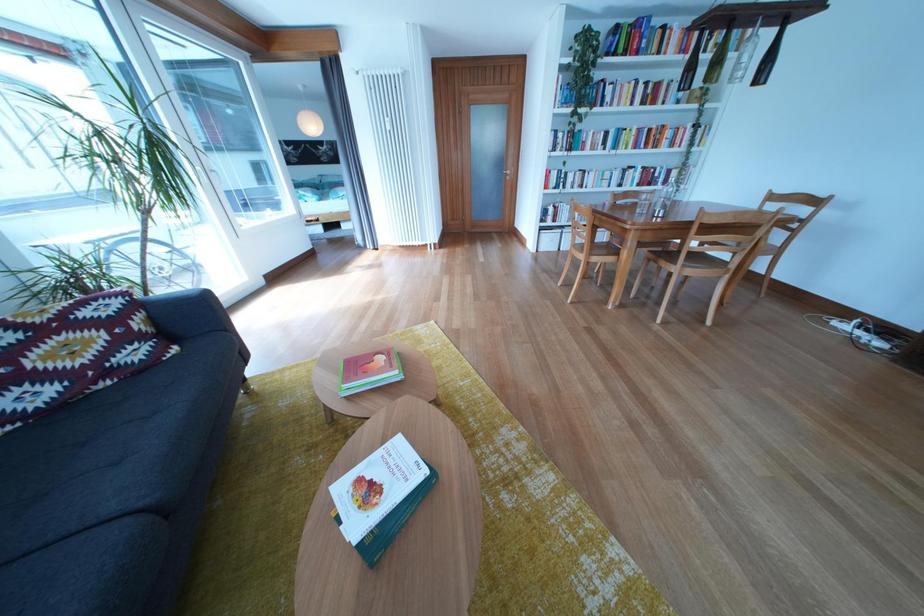
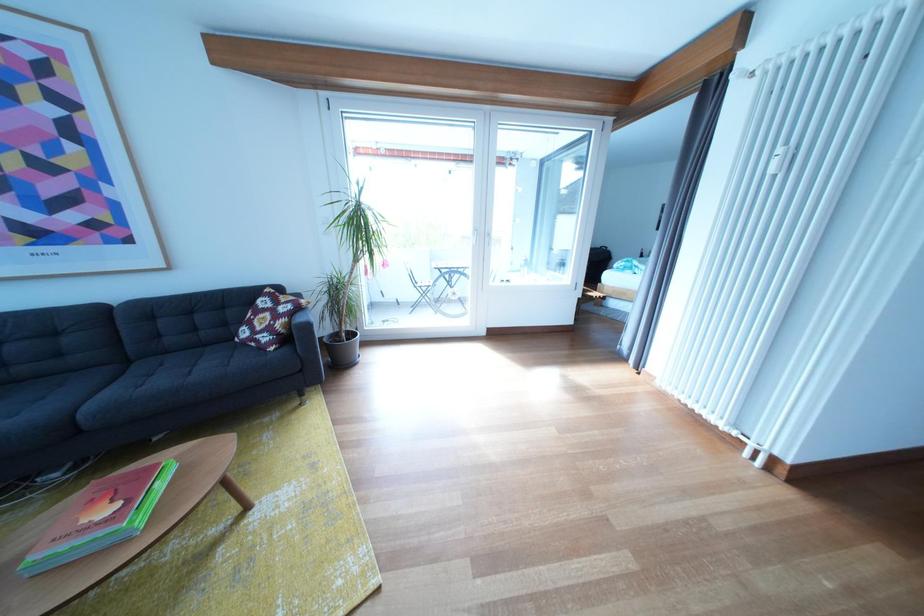
Where in the second image is the point corresponding to point (153, 323) from the first image?

(296, 326)